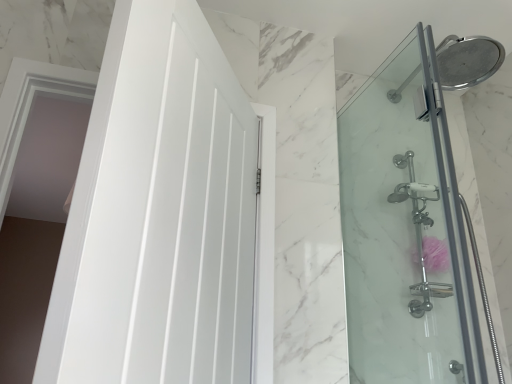
Question: Considering the relative positions of white glossy door at left and clear glass shower door at right in the image provided, is white glossy door at left to the left or to the right of clear glass shower door at right?

Choices:
 (A) left
 (B) right

Answer: (A)

Question: Based on their sizes in the image, would you say white glossy door at left is bigger or smaller than clear glass shower door at right?

Choices:
 (A) small
 (B) big

Answer: (B)

Question: From the image's perspective, is white glossy door at left located above or below clear glass shower door at right?

Choices:
 (A) above
 (B) below

Answer: (A)

Question: Considering the relative positions of clear glass shower door at right and white glossy door at left in the image provided, is clear glass shower door at right to the left or to the right of white glossy door at left?

Choices:
 (A) left
 (B) right

Answer: (B)

Question: From a real-world perspective, is clear glass shower door at right above or below white glossy door at left?

Choices:
 (A) above
 (B) below

Answer: (A)

Question: Is point (349, 119) closer or farther from the camera than point (181, 165)?

Choices:
 (A) closer
 (B) farther

Answer: (B)

Question: From their relative heights in the image, would you say clear glass shower door at right is taller or shorter than white glossy door at left?

Choices:
 (A) tall
 (B) short

Answer: (A)